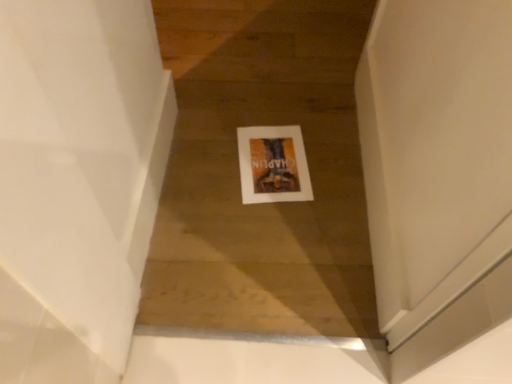
Where is `vacant space behind white matte picture frame at center`? The image size is (512, 384). vacant space behind white matte picture frame at center is located at coordinates (272, 104).